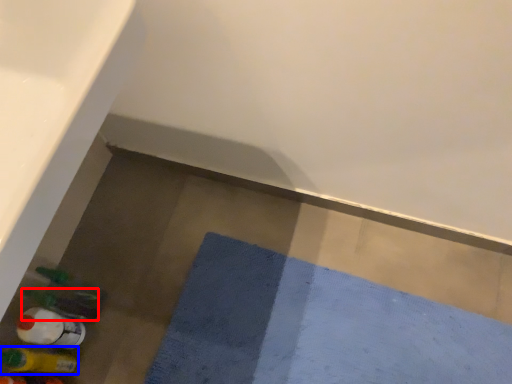
Question: Which object appears farthest to the camera in this image, bottle (highlighted by a red box) or bottle (highlighted by a blue box)?

Choices:
 (A) bottle
 (B) bottle

Answer: (A)